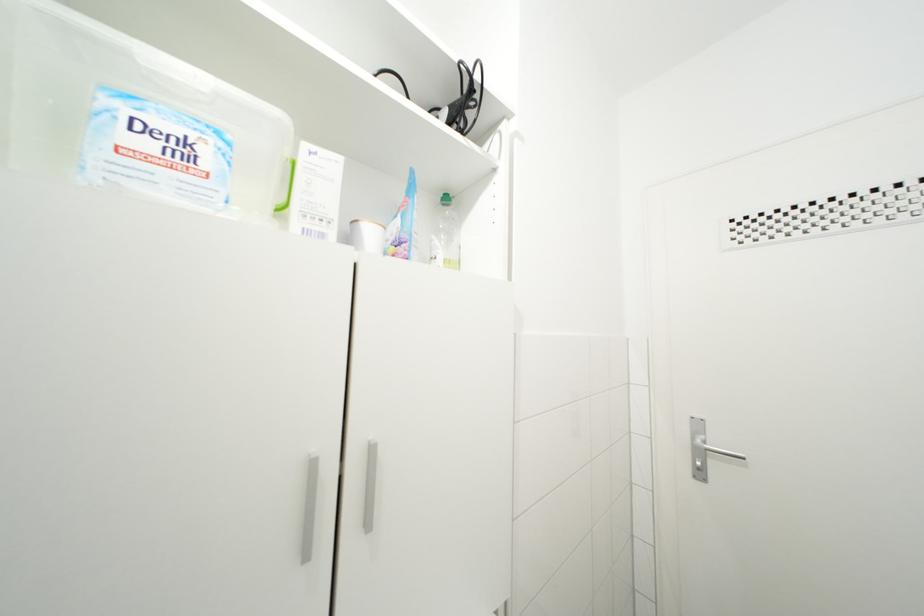
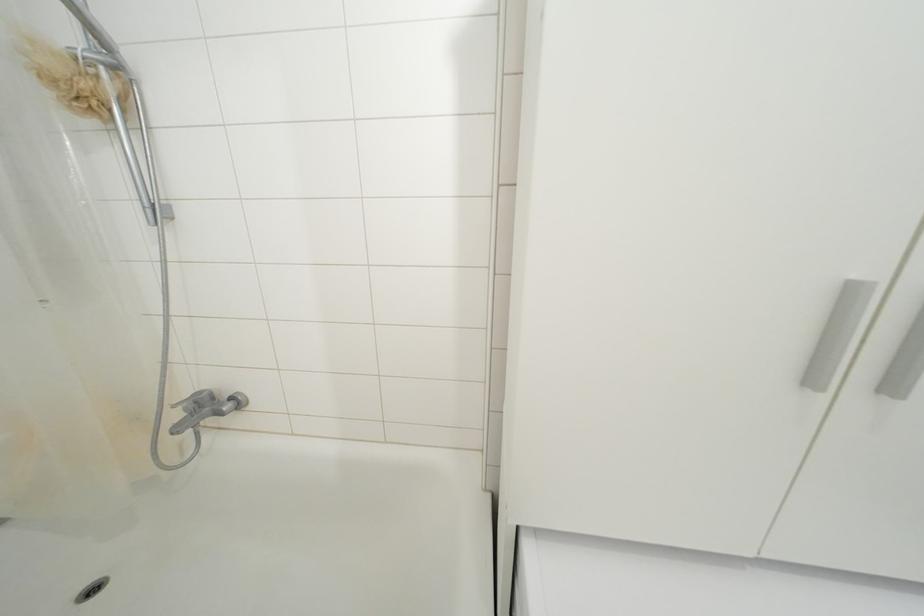
Find the pixel in the second image that matches (372,528) in the first image.

(896, 392)